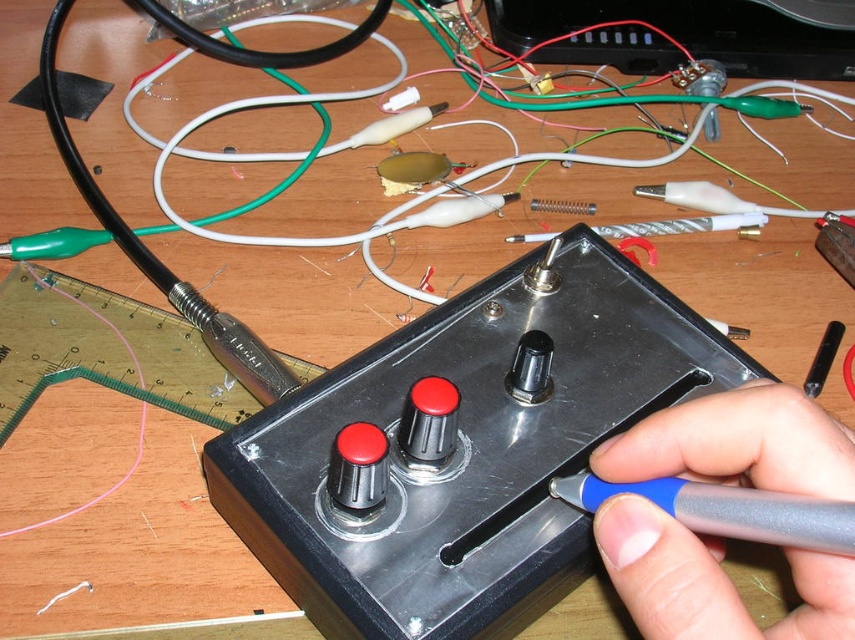
Question: Is black metallic control panel at center to the right of gray plastic pen at center from the viewer's perspective?

Choices:
 (A) yes
 (B) no

Answer: (B)

Question: Which of the following is the closest to the observer?

Choices:
 (A) (820, 461)
 (B) (438, 472)

Answer: (A)

Question: Does black metallic control panel at center have a larger size compared to gray plastic pen at center?

Choices:
 (A) yes
 (B) no

Answer: (A)

Question: Which of the following is the closest to the observer?

Choices:
 (A) (374, 412)
 (B) (799, 456)

Answer: (B)

Question: Among these points, which one is farthest from the camera?

Choices:
 (A) (705, 577)
 (B) (290, 582)

Answer: (B)

Question: Does black metallic control panel at center lie behind gray plastic pen at center?

Choices:
 (A) yes
 (B) no

Answer: (A)